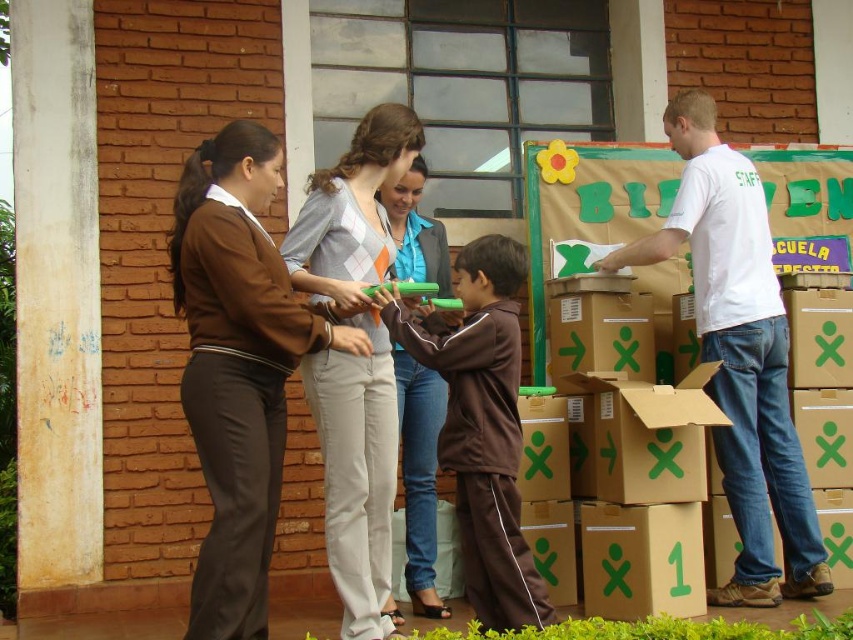
You are standing at the point labeled point (238, 365) in the image. What object is directly beneath your feet?

The point (238, 365) is on brown fabric jacket at center.